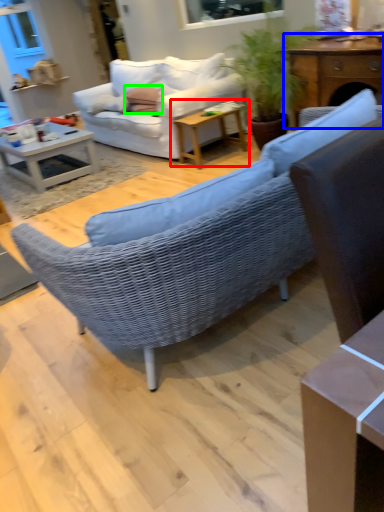
Question: Considering the real-world distances, which object is closest to table (highlighted by a red box)? table (highlighted by a blue box) or pillow (highlighted by a green box).

Choices:
 (A) table
 (B) pillow

Answer: (B)